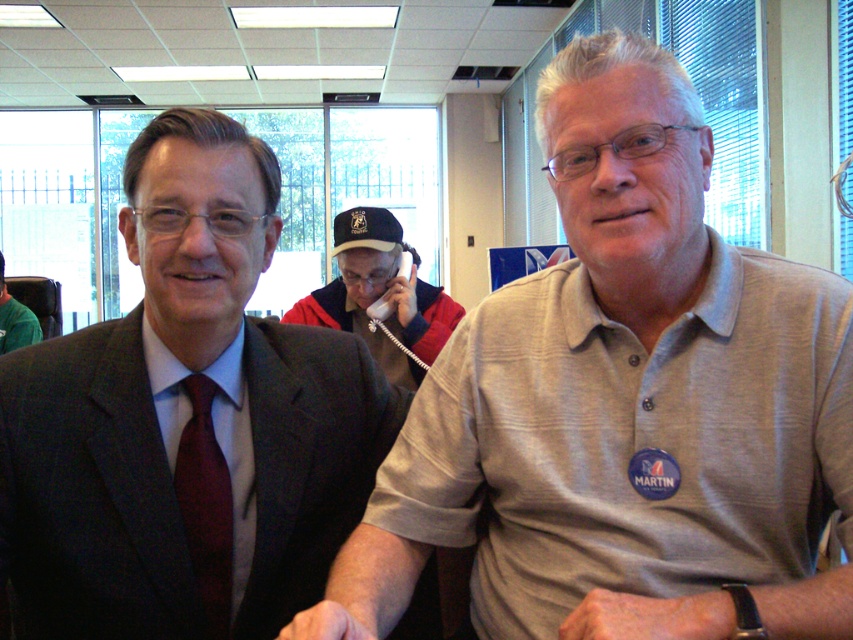
Is matte black suit at left positioned at the back of green fabric shirt at left?

That is False.

Who is more forward, (106, 538) or (1, 340)?

Point (106, 538) is more forward.

What do you see at coordinates (184, 422) in the screenshot? I see `matte black suit at left` at bounding box center [184, 422].

Where is `matte black suit at left`? matte black suit at left is located at coordinates (184, 422).

Which is more to the left, red jacket at center or matte red tie at left?

matte red tie at left is more to the left.

Identify the location of red jacket at center. Image resolution: width=853 pixels, height=640 pixels. (379, 296).

Locate an element on the screen. red jacket at center is located at coordinates (379, 296).

Identify the location of gray textured polo shirt at center. This screenshot has height=640, width=853. pos(624,404).

The height and width of the screenshot is (640, 853). What do you see at coordinates (624, 404) in the screenshot?
I see `gray textured polo shirt at center` at bounding box center [624, 404].

The width and height of the screenshot is (853, 640). I want to click on gray textured polo shirt at center, so click(624, 404).